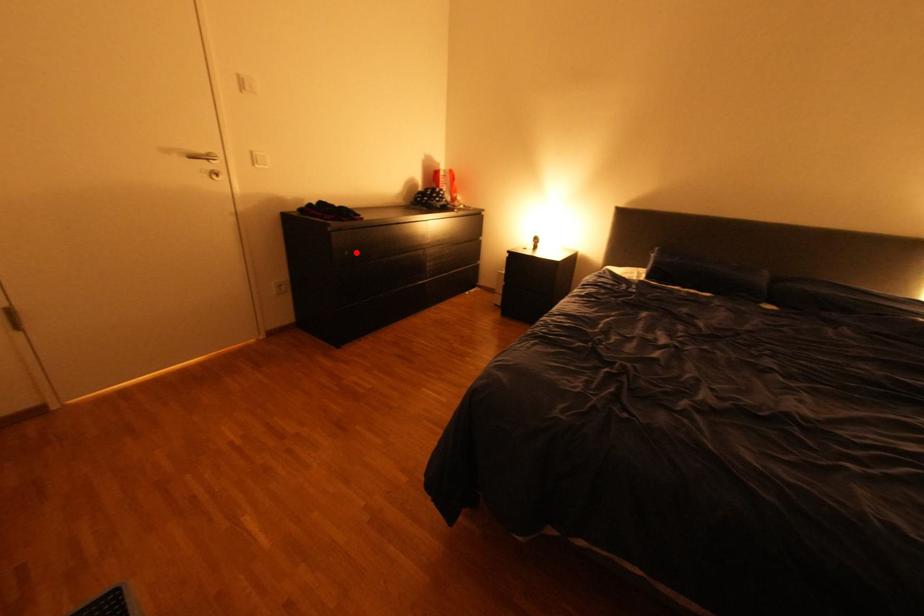
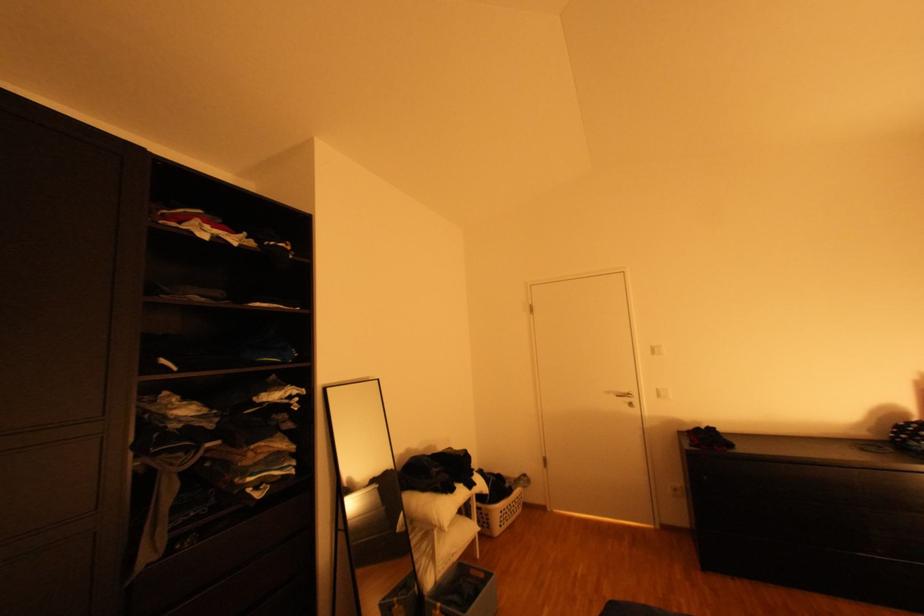
In the second image, find the point that corresponds to the highlighted location in the first image.

(715, 477)